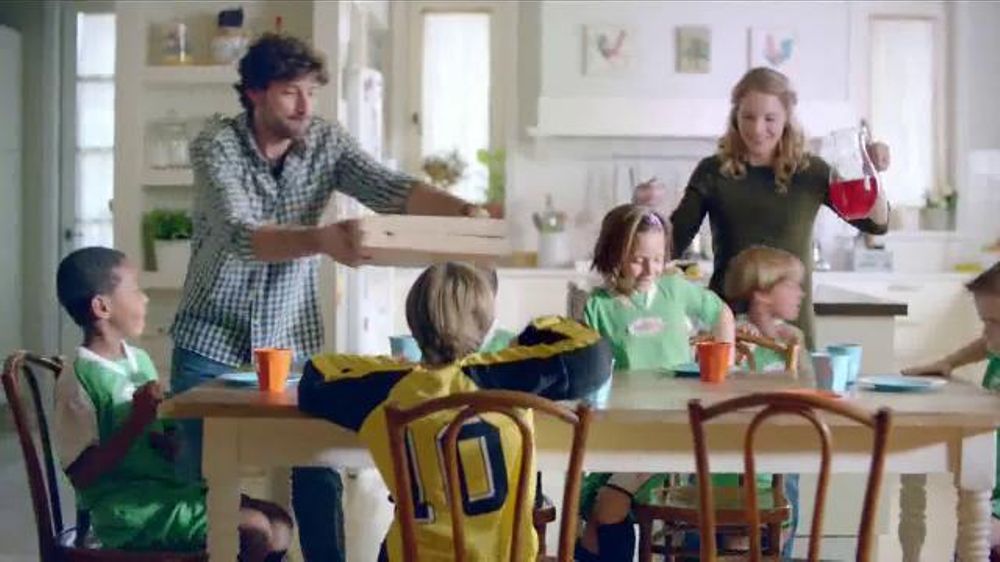
Locate an element on the screen. chairs is located at coordinates (24, 413), (511, 402), (804, 404).